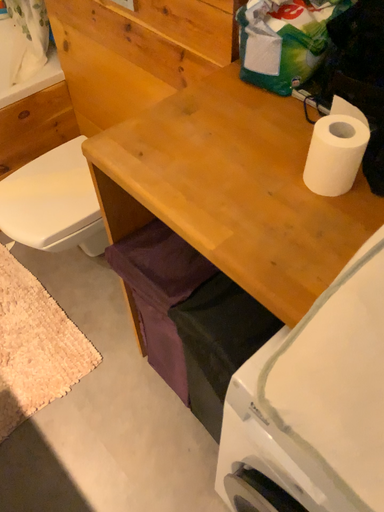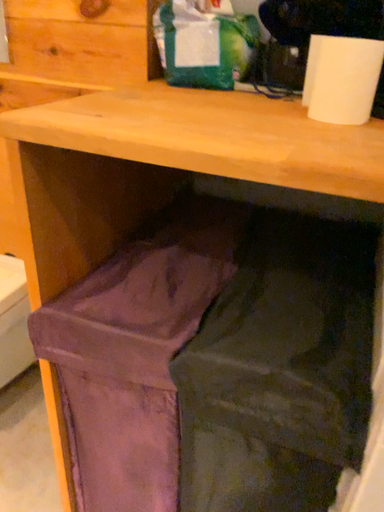
Question: How did the camera likely rotate when shooting the video?

Choices:
 (A) rotated right
 (B) rotated left

Answer: (A)